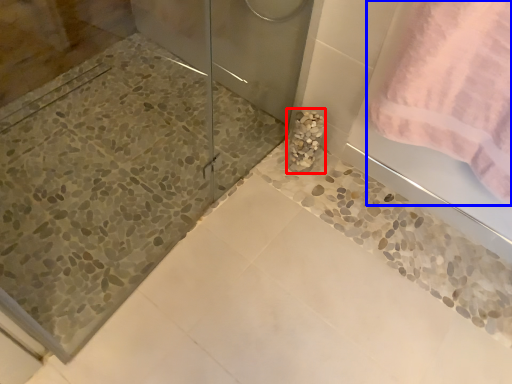
Question: Among these objects, which one is nearest to the camera, marble (highlighted by a red box) or towel (highlighted by a blue box)?

Choices:
 (A) marble
 (B) towel

Answer: (B)